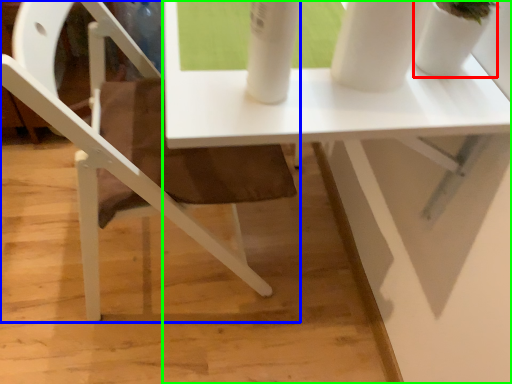
Question: Which object is the closest to the glass vase (highlighted by a red box)? Choose among these: chair (highlighted by a blue box) or table (highlighted by a green box).

Choices:
 (A) chair
 (B) table

Answer: (B)